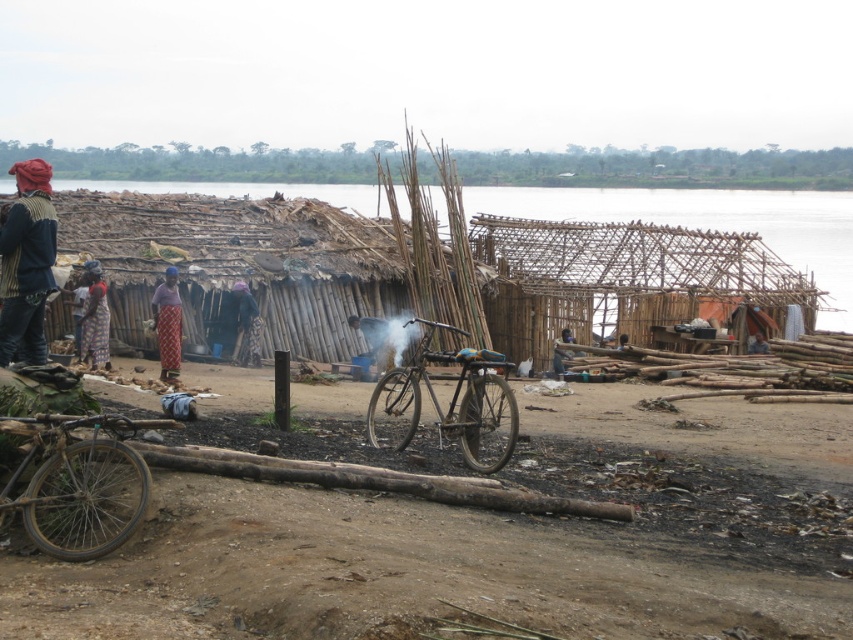
Between reddish-brown fabric at left and light brown wooden stick at center, which one appears on the right side from the viewer's perspective?

light brown wooden stick at center is more to the right.

Measure the distance between reddish-brown fabric at left and camera.

reddish-brown fabric at left is 73.62 feet away from camera.

Locate an element on the screen. The height and width of the screenshot is (640, 853). reddish-brown fabric at left is located at coordinates (94, 317).

This screenshot has height=640, width=853. What do you see at coordinates (26, 262) in the screenshot?
I see `striped fabric headscarf at left` at bounding box center [26, 262].

Does point (35, 250) lie in front of point (757, 346)?

Yes, it is.

Image resolution: width=853 pixels, height=640 pixels. What are the coordinates of `striped fabric headscarf at left` in the screenshot? It's located at [x=26, y=262].

Can you confirm if matte purple blouse at center is thinner than dark blue fabric at center?

No, matte purple blouse at center is not thinner than dark blue fabric at center.

Between matte purple blouse at center and dark blue fabric at center, which one has less height?

With less height is dark blue fabric at center.

Which is in front, point (177, 355) or point (254, 340)?

Point (177, 355)

Image resolution: width=853 pixels, height=640 pixels. I want to click on matte purple blouse at center, so click(167, 324).